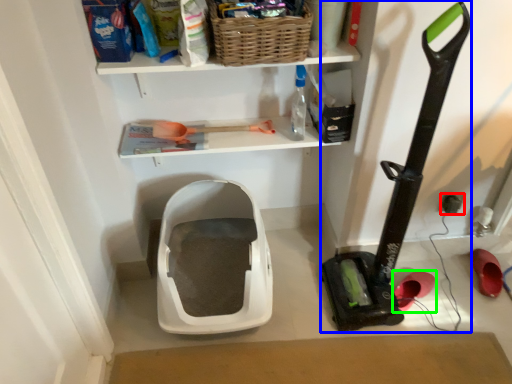
Question: Estimate the real-world distances between objects in this image. Which object is farther from electric outlet (highlighted by a red box), equipment (highlighted by a blue box) or footwear (highlighted by a green box)?

Choices:
 (A) equipment
 (B) footwear

Answer: (A)